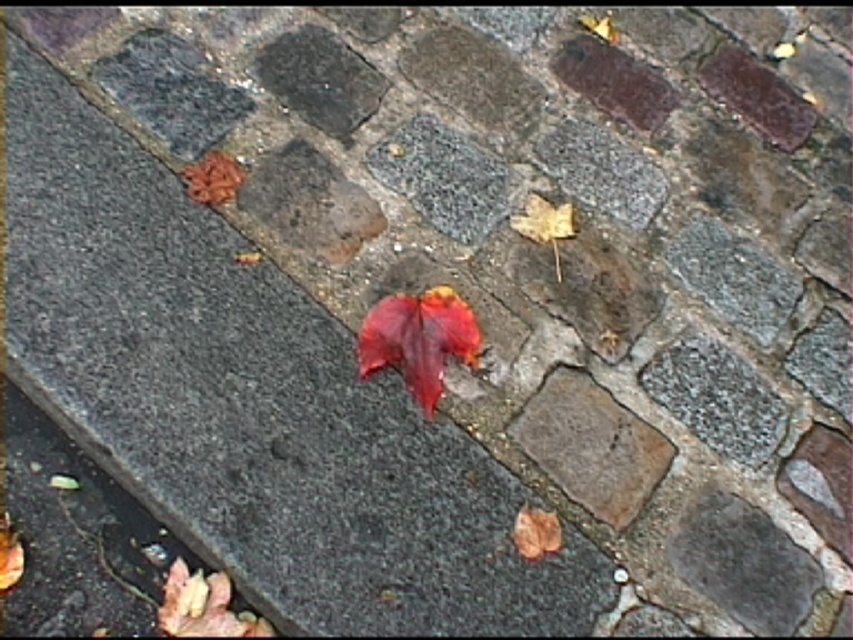
Question: Which point is closer to the camera?

Choices:
 (A) brown matte maple leaf at lower right
 (B) yellow matte maple leaf at upper right

Answer: (A)

Question: Which of these objects is positioned closest to the yellow matte maple leaf at upper right?

Choices:
 (A) shiny red maple leaf at center
 (B) brown matte maple leaf at lower right

Answer: (A)

Question: Does shiny red maple leaf at center have a lesser width compared to brown matte maple leaf at lower right?

Choices:
 (A) yes
 (B) no

Answer: (B)

Question: Is shiny red maple leaf at center to the left of brown matte maple leaf at lower right from the viewer's perspective?

Choices:
 (A) no
 (B) yes

Answer: (B)

Question: Can you confirm if shiny red maple leaf at center is bigger than brown matte maple leaf at lower right?

Choices:
 (A) no
 (B) yes

Answer: (B)

Question: Among these points, which one is nearest to the camera?

Choices:
 (A) (526, 518)
 (B) (456, 326)

Answer: (A)